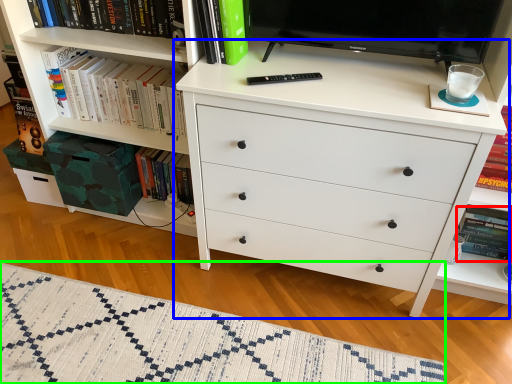
Question: Which object is positioned closest to paperback book (highlighted by a red box)? Select from chest of drawers (highlighted by a blue box) and blanket (highlighted by a green box).

Choices:
 (A) chest of drawers
 (B) blanket

Answer: (A)